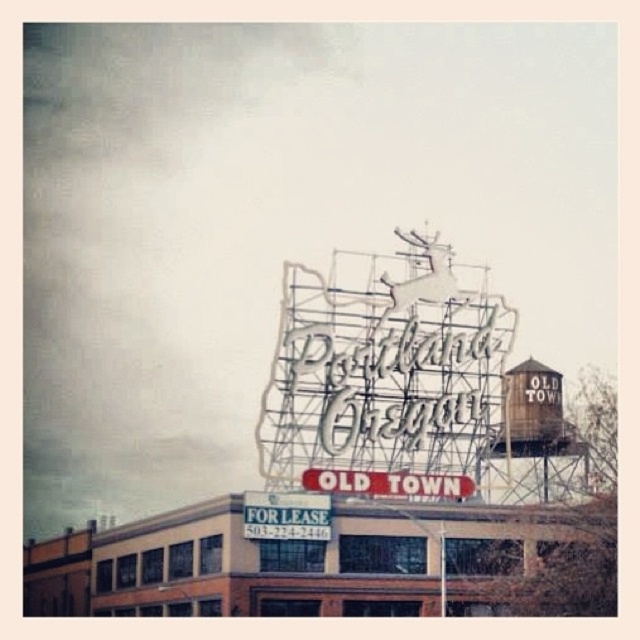
Can you confirm if metallic wireframe sign at center is taller than white metal sign at center?

Correct, metallic wireframe sign at center is much taller as white metal sign at center.

Does point (292, 481) come behind point (422, 476)?

No, it is in front of (422, 476).

Describe the element at coordinates (387, 376) in the screenshot. The height and width of the screenshot is (640, 640). I see `metallic wireframe sign at center` at that location.

Identify the location of metallic wireframe sign at center. Image resolution: width=640 pixels, height=640 pixels. (387, 376).

Does rustic wooden water tower at upper right have a greater height compared to white metal sign at center?

Indeed, rustic wooden water tower at upper right has a greater height compared to white metal sign at center.

In the scene shown: Who is more distant from viewer, (540, 400) or (371, 476)?

The point (540, 400) is behind.

This screenshot has width=640, height=640. What are the coordinates of `rustic wooden water tower at upper right` in the screenshot? It's located at (532, 408).

Who is taller, metallic wireframe sign at center or rustic wooden water tower at upper right?

With more height is metallic wireframe sign at center.

The image size is (640, 640). Describe the element at coordinates (387, 376) in the screenshot. I see `metallic wireframe sign at center` at that location.

Measure the distance between metallic wireframe sign at center and camera.

metallic wireframe sign at center is 106.63 meters away from camera.

The image size is (640, 640). Identify the location of metallic wireframe sign at center. (387, 376).